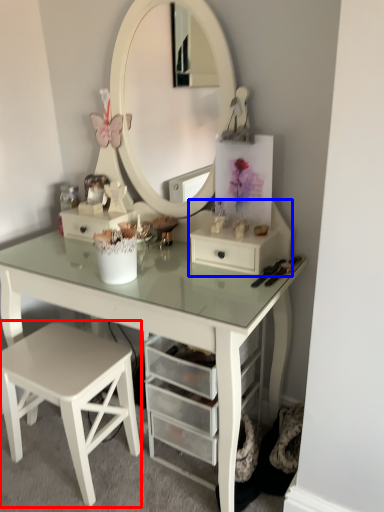
Question: Which object is further to the camera taking this photo, stool (highlighted by a red box) or chest of drawers (highlighted by a blue box)?

Choices:
 (A) stool
 (B) chest of drawers

Answer: (B)